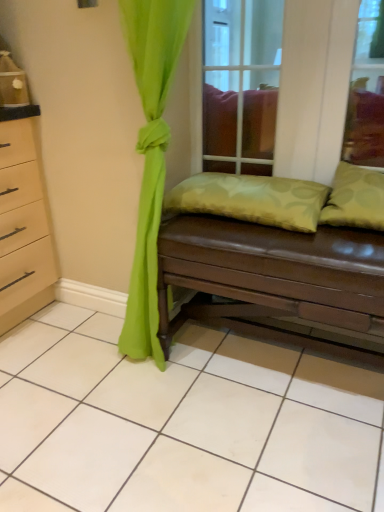
Find the location of a particular element. Image resolution: width=384 pixels, height=512 pixels. green textured pillow at center, placed as the 1th pillow when sorted from left to right is located at coordinates pos(251,199).

Image resolution: width=384 pixels, height=512 pixels. Find the location of `brown leather studio couch at center`. brown leather studio couch at center is located at coordinates (285, 272).

Measure the distance between transparent glass door at center and camera.

transparent glass door at center is 1.38 meters away from camera.

Identify the location of green textured pillow at center, placed as the 1th pillow when sorted from left to right. (251, 199).

Are green fabric pillow at right, arranged as the first pillow when viewed from the right, and green textured pillow at center, placed as the 1th pillow when sorted from left to right, located far from each other?

green fabric pillow at right, arranged as the first pillow when viewed from the right, is near green textured pillow at center, placed as the 1th pillow when sorted from left to right, not far away.

Who is taller, green fabric pillow at right, acting as the 2th pillow starting from the left, or green textured pillow at center, the 2th pillow viewed from the right?

Standing taller between the two is green fabric pillow at right, acting as the 2th pillow starting from the left.

Between green fabric pillow at right, acting as the 2th pillow starting from the left, and green textured pillow at center, the 2th pillow viewed from the right, which one appears on the right side from the viewer's perspective?

Positioned to the right is green fabric pillow at right, acting as the 2th pillow starting from the left.

Is brown leather studio couch at center oriented towards transparent glass door at center?

No, brown leather studio couch at center is not aimed at transparent glass door at center.

Does point (303, 237) come in front of point (218, 31)?

Yes, point (303, 237) is in front of point (218, 31).

From a real-world perspective, is brown leather studio couch at center located higher than transparent glass door at center?

Incorrect, from a real-world perspective, brown leather studio couch at center is lower than transparent glass door at center.

Considering the relative positions of brown leather studio couch at center and transparent glass door at center in the image provided, is brown leather studio couch at center to the right of transparent glass door at center from the viewer's perspective?

Yes.

I want to click on pillow that is the 2nd one when counting rightward from the transparent glass door at center, so click(355, 198).

From a real-world perspective, which is physically below, green fabric pillow at right, arranged as the first pillow when viewed from the right, or transparent glass door at center?

From a 3D spatial view, green fabric pillow at right, arranged as the first pillow when viewed from the right, is below.

Who is taller, green fabric pillow at right, arranged as the first pillow when viewed from the right, or transparent glass door at center?

Standing taller between the two is transparent glass door at center.

Is point (224, 122) behind point (179, 195)?

Yes, point (224, 122) is behind point (179, 195).

From a real-world perspective, does transparent glass door at center stand above green textured pillow at center, placed as the 1th pillow when sorted from left to right?

Yes.

Is transparent glass door at center smaller than green textured pillow at center, the 2th pillow viewed from the right?

Incorrect, transparent glass door at center is not smaller in size than green textured pillow at center, the 2th pillow viewed from the right.

Is transparent glass door at center surrounding green textured pillow at center, the 2th pillow viewed from the right?

No, green textured pillow at center, the 2th pillow viewed from the right, is not inside transparent glass door at center.

You are a GUI agent. You are given a task and a screenshot of the screen. Output one action in this format:
    pyautogui.click(x=<x>, y=<y>)
    Task: Click on the glass door behind the green textured pillow at center, placed as the 1th pillow when sorted from left to right
    
    Given the screenshot: What is the action you would take?
    pyautogui.click(x=241, y=84)

How many degrees apart are the facing directions of green textured pillow at center, the 2th pillow viewed from the right, and transparent glass door at center?

1.03 degrees separate the facing orientations of green textured pillow at center, the 2th pillow viewed from the right, and transparent glass door at center.

Is green textured pillow at center, placed as the 1th pillow when sorted from left to right, oriented towards transparent glass door at center?

No, green textured pillow at center, placed as the 1th pillow when sorted from left to right, is not oriented towards transparent glass door at center.

Can you confirm if green textured pillow at center, placed as the 1th pillow when sorted from left to right, is shorter than transparent glass door at center?

Yes.

In terms of height, does transparent glass door at center look taller or shorter compared to green fabric pillow at right, arranged as the first pillow when viewed from the right?

Considering their sizes, transparent glass door at center has more height than green fabric pillow at right, arranged as the first pillow when viewed from the right.

Between point (254, 128) and point (350, 186), which one is positioned behind?

Point (254, 128)

From the picture: Is transparent glass door at center facing towards green fabric pillow at right, acting as the 2th pillow starting from the left?

No, transparent glass door at center is not facing towards green fabric pillow at right, acting as the 2th pillow starting from the left.

Can you confirm if transparent glass door at center is positioned to the right of green fabric pillow at right, acting as the 2th pillow starting from the left?

In fact, transparent glass door at center is to the left of green fabric pillow at right, acting as the 2th pillow starting from the left.

Is brown leather studio couch at center turned away from green fabric pillow at right, arranged as the first pillow when viewed from the right?

brown leather studio couch at center is not turned away from green fabric pillow at right, arranged as the first pillow when viewed from the right.

In the image, is brown leather studio couch at center on the left side or the right side of green fabric pillow at right, acting as the 2th pillow starting from the left?

brown leather studio couch at center is to the left of green fabric pillow at right, acting as the 2th pillow starting from the left.

From a real-world perspective, is brown leather studio couch at center beneath green fabric pillow at right, arranged as the first pillow when viewed from the right?

Correct, in the physical world, brown leather studio couch at center is lower than green fabric pillow at right, arranged as the first pillow when viewed from the right.

I want to click on pillow located on the right of green textured pillow at center, the 2th pillow viewed from the right, so click(x=355, y=198).

In order to click on studio couch in front of the transparent glass door at center in this screenshot , I will do (285, 272).

Estimate the real-world distances between objects in this image. Which object is further from brown leather studio couch at center, green textured pillow at center, the 2th pillow viewed from the right, or transparent glass door at center?

Based on the image, transparent glass door at center appears to be further to brown leather studio couch at center.

Which object lies further to the anchor point green textured pillow at center, the 2th pillow viewed from the right, transparent glass door at center or brown leather studio couch at center?

transparent glass door at center lies further to green textured pillow at center, the 2th pillow viewed from the right, than the other object.

Considering their positions, is brown leather studio couch at center positioned further to green fabric pillow at right, arranged as the first pillow when viewed from the right, than transparent glass door at center?

The object further to green fabric pillow at right, arranged as the first pillow when viewed from the right, is transparent glass door at center.

Estimate the real-world distances between objects in this image. Which object is closer to green textured pillow at center, the 2th pillow viewed from the right, transparent glass door at center or green fabric pillow at right, arranged as the first pillow when viewed from the right?

green fabric pillow at right, arranged as the first pillow when viewed from the right, is closer to green textured pillow at center, the 2th pillow viewed from the right.

Looking at the image, which one is located further to transparent glass door at center, green fabric pillow at right, acting as the 2th pillow starting from the left, or brown leather studio couch at center?

The object further to transparent glass door at center is brown leather studio couch at center.

From the picture: Estimate the real-world distances between objects in this image. Which object is further from green fabric pillow at right, arranged as the first pillow when viewed from the right, brown leather studio couch at center or green textured pillow at center, the 2th pillow viewed from the right?

brown leather studio couch at center is positioned further to the anchor green fabric pillow at right, arranged as the first pillow when viewed from the right.

Considering their positions, is brown leather studio couch at center positioned closer to green textured pillow at center, the 2th pillow viewed from the right, than transparent glass door at center?

brown leather studio couch at center is positioned closer to the anchor green textured pillow at center, the 2th pillow viewed from the right.

When comparing their distances from transparent glass door at center, does green textured pillow at center, placed as the 1th pillow when sorted from left to right, or brown leather studio couch at center seem further?

Based on the image, brown leather studio couch at center appears to be further to transparent glass door at center.

What are the coordinates of `pillow between transparent glass door at center and green fabric pillow at right, arranged as the first pillow when viewed from the right, vertically` in the screenshot? It's located at (251, 199).

Find the location of a particular element. The image size is (384, 512). pillow between green textured pillow at center, placed as the 1th pillow when sorted from left to right, and brown leather studio couch at center, in the vertical direction is located at coordinates (355, 198).